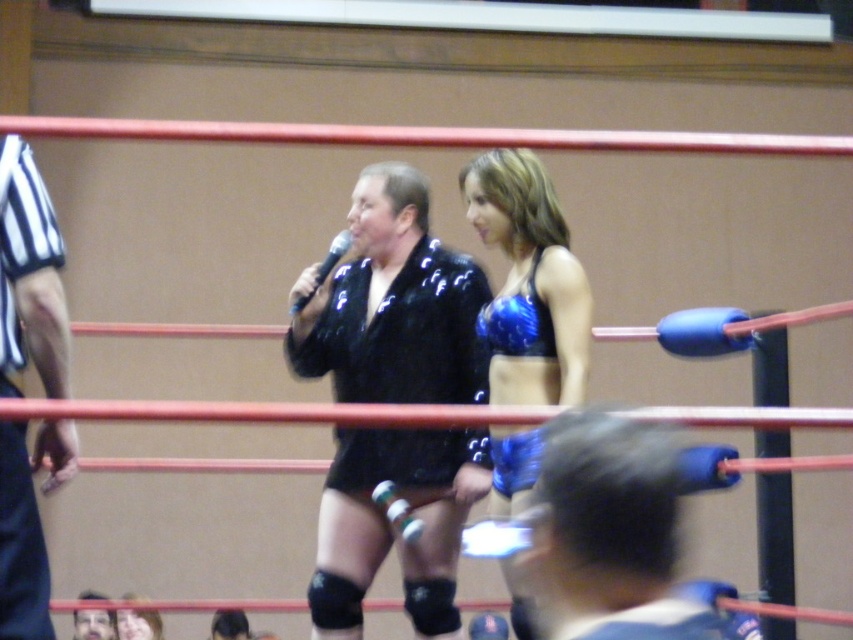
You are a stagehand in the wrestling ring and need to determine which object takes up more space in the scene. Which is larger between the striped fabric shirt at left and the black plastic microphone at center?

The striped fabric shirt at left is bigger than the black plastic microphone at center, so it takes up more space in the scene.

You are a photographer positioned in the front row of the wrestling ring. You want to take a photo that includes both the point at position (x=13, y=340) and the point at position (x=296, y=304). Which point should you focus on first to ensure both are in sharp focus?

You should focus on the point at position (x=13, y=340) first because it is closer to the camera than the point at position (x=296, y=304). This ensures that both points will be in focus when you adjust your camera settings accordingly.